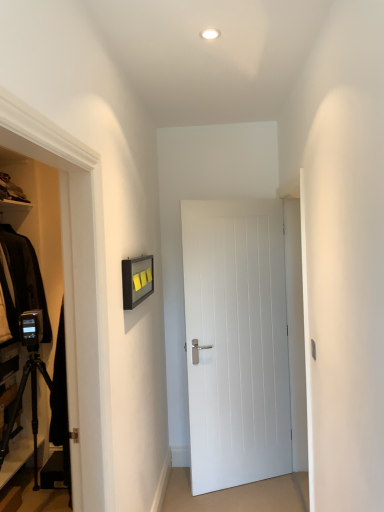
Question: Considering the positions of point (279, 414) and point (29, 224), is point (279, 414) closer or farther from the camera than point (29, 224)?

Choices:
 (A) closer
 (B) farther

Answer: (A)

Question: Looking at their shapes, would you say white smooth door at center is wider or thinner than black matte tripod at lower left?

Choices:
 (A) wide
 (B) thin

Answer: (B)

Question: Which object is positioned farthest from the black matte tripod at lower left?

Choices:
 (A) white glossy light fixture at upper center
 (B) white smooth door at center

Answer: (A)

Question: Estimate the real-world distances between objects in this image. Which object is closer to the white smooth door at center?

Choices:
 (A) black matte tripod at lower left
 (B) white glossy light fixture at upper center

Answer: (A)